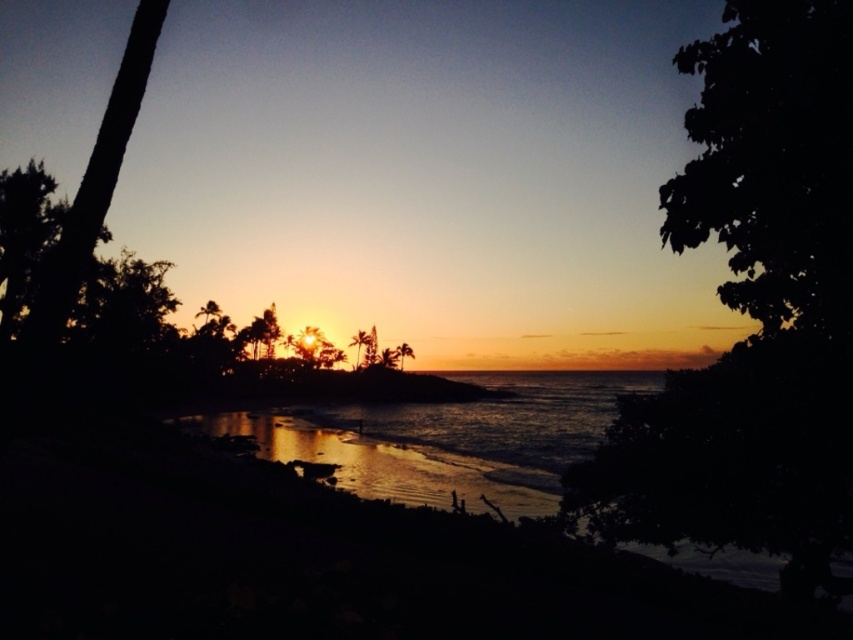
Question: From the image, what is the correct spatial relationship of dark leafy tree at right in relation to dark green leafy tree at upper right?

Choices:
 (A) right
 (B) left

Answer: (B)

Question: Is dark leafy tree at right further to the viewer compared to dark green leafy tree at upper right?

Choices:
 (A) yes
 (B) no

Answer: (B)

Question: Which point is farther from the camera taking this photo?

Choices:
 (A) (851, 80)
 (B) (810, 573)
 (C) (61, 266)

Answer: (B)

Question: Is dark brown bark tree at left closer to the viewer compared to green leafy palm tree at center?

Choices:
 (A) no
 (B) yes

Answer: (B)

Question: Which of the following is the closest to the observer?

Choices:
 (A) dark green leafy tree at upper right
 (B) green leafy palm tree at center
 (C) dark leafy tree at right
 (D) dark brown bark tree at left

Answer: (D)

Question: Which object is the closest to the dark green leafy tree at upper right?

Choices:
 (A) dark leafy tree at right
 (B) green leafy palm tree at center

Answer: (A)